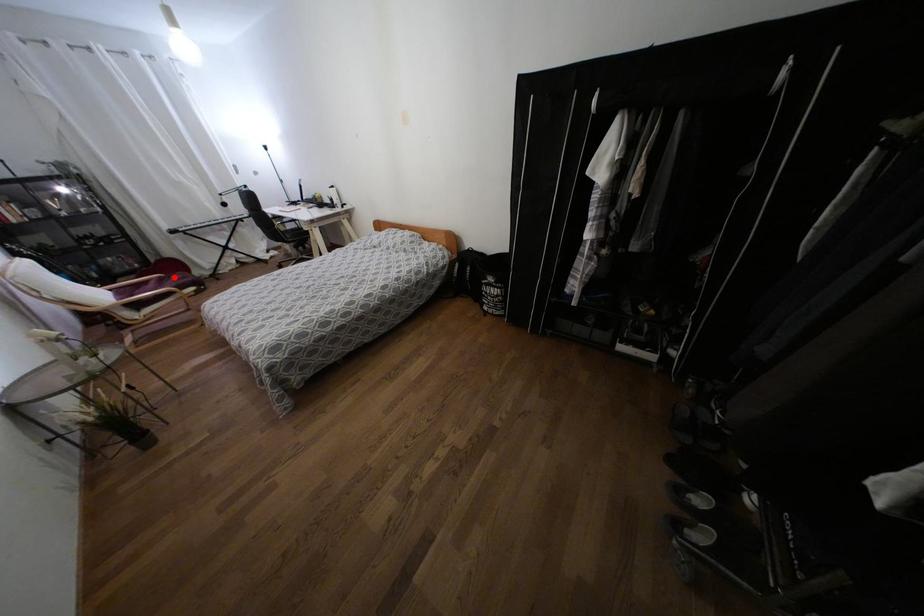
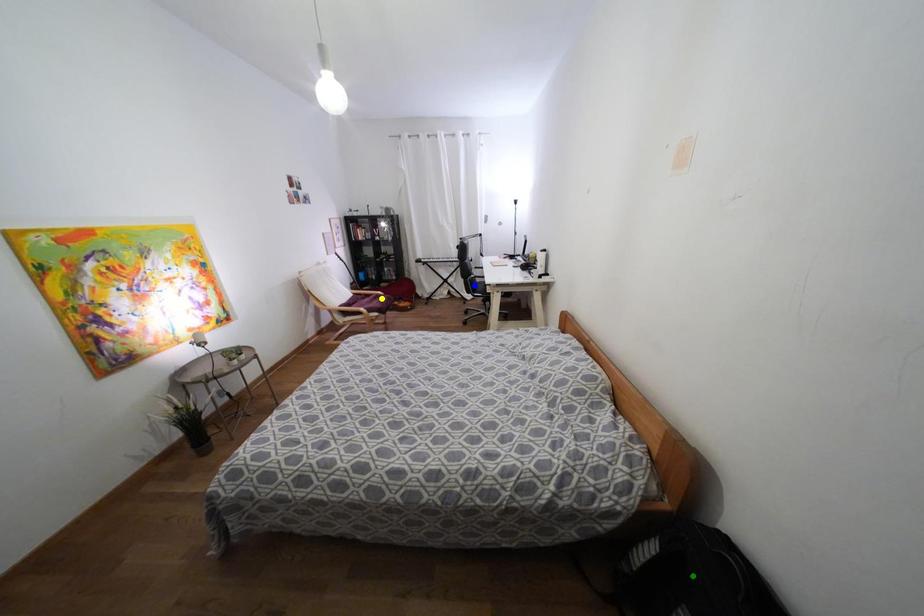
Question: I am providing you with two images of the same scene from different viewpoints. A red point is marked on the first image. You are given multiple points on the second image. Which spot in image 2 lines up with the point in image 1?

Choices:
 (A) green point
 (B) yellow point
 (C) blue point

Answer: (B)